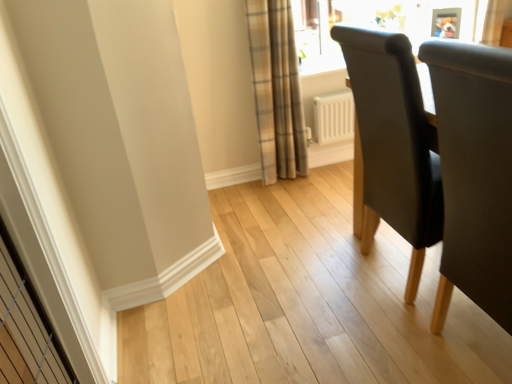
Question: Does plaid fabric curtain at upper center have a greater width compared to black leather chair at right, positioned as the second chair in back-to-front order?

Choices:
 (A) no
 (B) yes

Answer: (A)

Question: Could you tell me if plaid fabric curtain at upper center is turned towards black leather chair at right, placed as the 1th chair when sorted from front to back?

Choices:
 (A) yes
 (B) no

Answer: (A)

Question: Is plaid fabric curtain at upper center closer to camera compared to black leather chair at right, placed as the 1th chair when sorted from front to back?

Choices:
 (A) yes
 (B) no

Answer: (B)

Question: From the image's perspective, is plaid fabric curtain at upper center above black leather chair at right, placed as the 1th chair when sorted from front to back?

Choices:
 (A) no
 (B) yes

Answer: (B)

Question: Is plaid fabric curtain at upper center touching black leather chair at right, positioned as the second chair in back-to-front order?

Choices:
 (A) yes
 (B) no

Answer: (B)

Question: Can you confirm if plaid fabric curtain at upper center is shorter than black leather chair at right, placed as the 1th chair when sorted from front to back?

Choices:
 (A) yes
 (B) no

Answer: (B)

Question: From the image's perspective, is dark gray fabric chair at right, which is the 1th chair from back to front, above black leather chair at right, placed as the 1th chair when sorted from front to back?

Choices:
 (A) yes
 (B) no

Answer: (A)

Question: Is dark gray fabric chair at right, which is the 1th chair from back to front, wider than black leather chair at right, placed as the 1th chair when sorted from front to back?

Choices:
 (A) yes
 (B) no

Answer: (A)

Question: Considering the relative sizes of dark gray fabric chair at right, which is the 1th chair from back to front, and black leather chair at right, placed as the 1th chair when sorted from front to back, in the image provided, is dark gray fabric chair at right, which is the 1th chair from back to front, shorter than black leather chair at right, placed as the 1th chair when sorted from front to back,?

Choices:
 (A) no
 (B) yes

Answer: (A)

Question: Is black leather chair at right, placed as the 1th chair when sorted from front to back, located within dark gray fabric chair at right, the 2th chair viewed from the front?

Choices:
 (A) no
 (B) yes

Answer: (A)

Question: Is dark gray fabric chair at right, the 2th chair viewed from the front, aimed at black leather chair at right, placed as the 1th chair when sorted from front to back?

Choices:
 (A) yes
 (B) no

Answer: (B)

Question: From the image's perspective, would you say dark gray fabric chair at right, which is the 1th chair from back to front, is shown under black leather chair at right, positioned as the second chair in back-to-front order?

Choices:
 (A) no
 (B) yes

Answer: (A)

Question: Is black leather chair at right, placed as the 1th chair when sorted from front to back, positioned beyond the bounds of plaid fabric curtain at upper center?

Choices:
 (A) yes
 (B) no

Answer: (A)